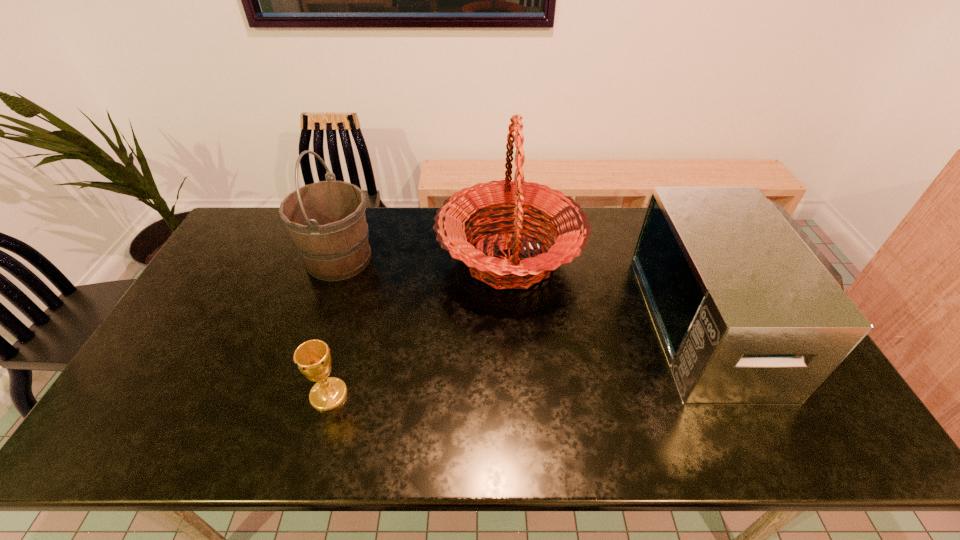
At what (x,y) coordinates should I click in order to perform the action: click on vacant space located on the front-facing side of the rightmost object. Please return your answer as a coordinate pair (x, y). This screenshot has width=960, height=540. Looking at the image, I should click on (542, 322).

The height and width of the screenshot is (540, 960). What are the coordinates of `vacant space located on the left of the shortest object` in the screenshot? It's located at (162, 395).

Locate an element on the screen. This screenshot has width=960, height=540. basket that is at the far edge is located at coordinates (567, 222).

At what (x,y) coordinates should I click in order to perform the action: click on bucket that is at the far edge. Please return your answer as a coordinate pair (x, y). Looking at the image, I should click on (326, 220).

This screenshot has width=960, height=540. In order to click on object present at the right edge in this screenshot , I will do `click(748, 310)`.

Locate an element on the screen. This screenshot has width=960, height=540. vacant space at the far edge of the desktop is located at coordinates (403, 234).

Where is `vacant space at the near edge of the desktop`? Image resolution: width=960 pixels, height=540 pixels. vacant space at the near edge of the desktop is located at coordinates (360, 441).

At what (x,y) coordinates should I click in order to perform the action: click on vacant space at the left edge of the desktop. Please return your answer as a coordinate pair (x, y). Looking at the image, I should click on (199, 310).

Identify the location of vacant space at the right edge of the desktop. The height and width of the screenshot is (540, 960). (825, 392).

The width and height of the screenshot is (960, 540). Find the location of `free space between the second tallest object and the rightmost object`. free space between the second tallest object and the rightmost object is located at coordinates (529, 291).